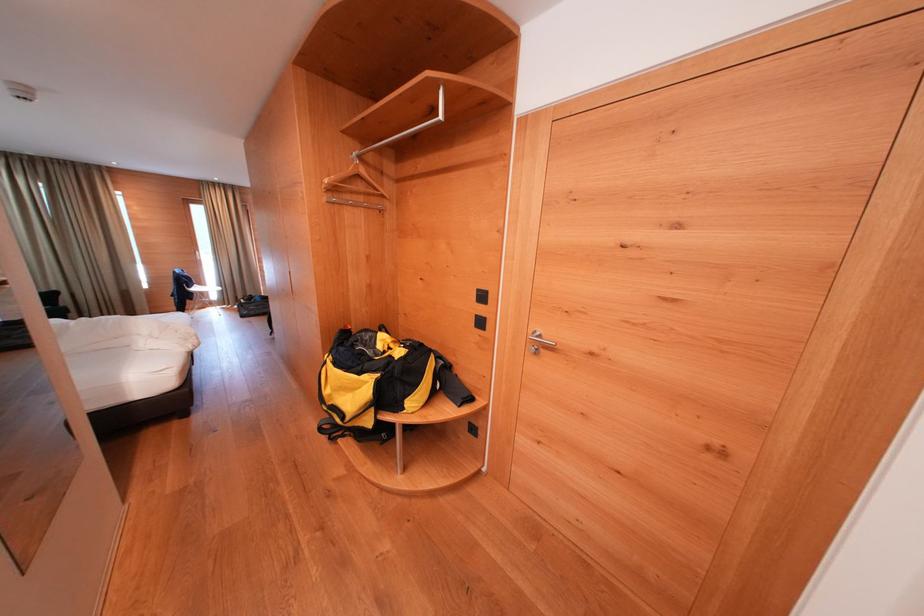
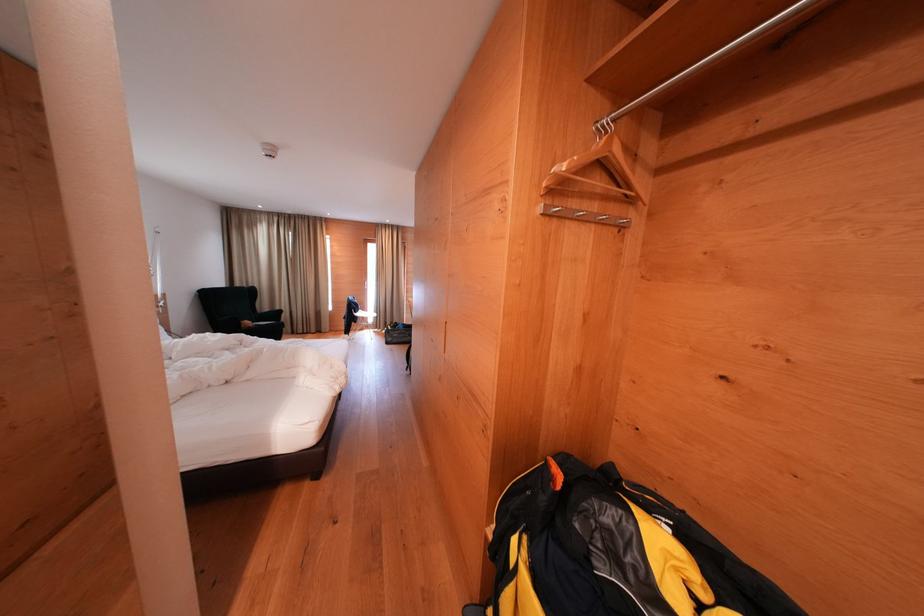
In the second image, find the point that corresponds to (x=215, y=293) in the first image.

(374, 318)